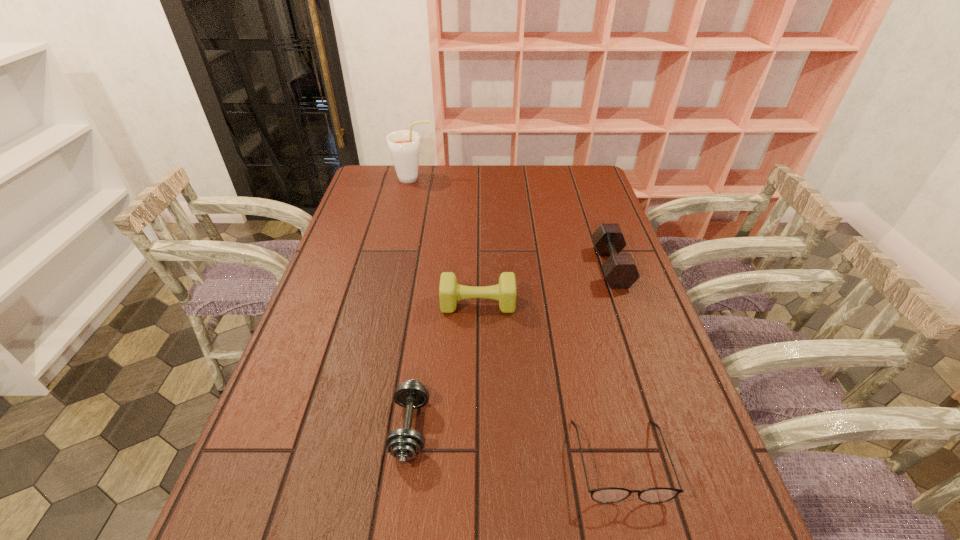
I want to click on free space at the far left corner, so click(396, 187).

Locate an element on the screen. free space between the third farthest object and the rightmost dumbbell is located at coordinates (545, 285).

Identify the location of vacant space that's between the spectacles and the leftmost dumbbell. This screenshot has height=540, width=960. (515, 444).

This screenshot has height=540, width=960. I want to click on blank region between the third object from left to right and the rightmost dumbbell, so click(545, 285).

The width and height of the screenshot is (960, 540). I want to click on free space between the rightmost dumbbell and the third object from left to right, so click(545, 285).

I want to click on vacant space that's between the tallest object and the farthest dumbbell, so click(x=513, y=222).

Where is `free space between the nearest dumbbell and the second farthest object`? The height and width of the screenshot is (540, 960). free space between the nearest dumbbell and the second farthest object is located at coordinates (511, 348).

Locate an element on the screen. The height and width of the screenshot is (540, 960). vacant region between the shortest object and the farthest object is located at coordinates (516, 319).

Where is `free spot between the farthest dumbbell and the second farthest dumbbell`? The image size is (960, 540). free spot between the farthest dumbbell and the second farthest dumbbell is located at coordinates (545, 285).

The height and width of the screenshot is (540, 960). In order to click on free spot between the farthest dumbbell and the nearest dumbbell in this screenshot , I will do `click(511, 348)`.